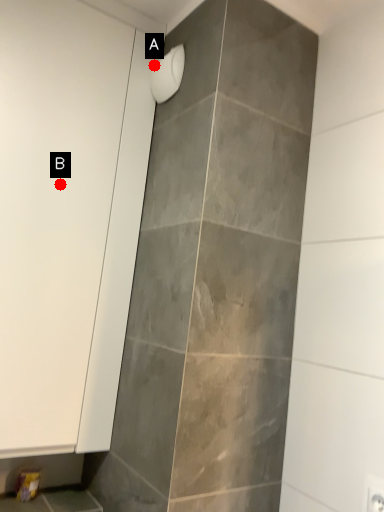
Question: Two points are circled on the image, labeled by A and B beside each circle. Which of the following is the closest to the observer?

Choices:
 (A) A is closer
 (B) B is closer

Answer: (B)